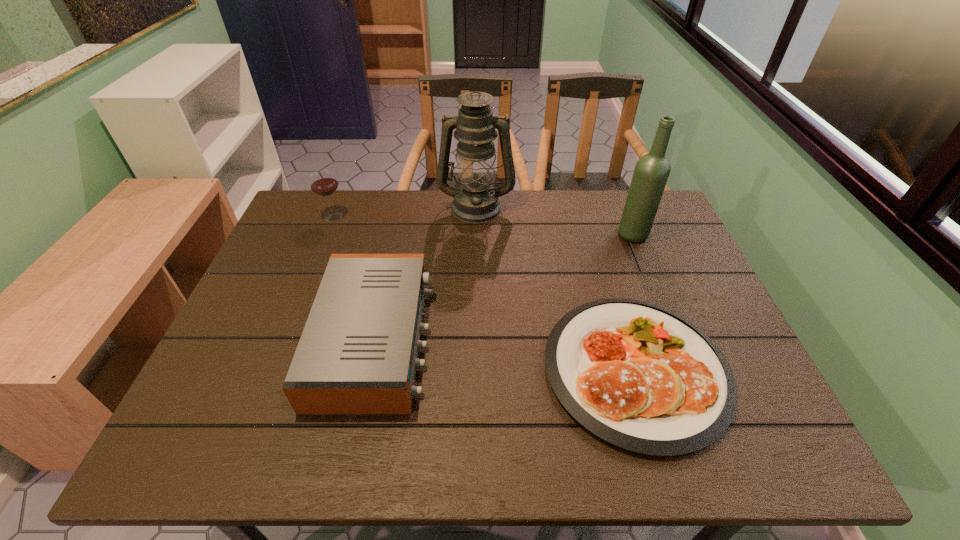
You are a GUI agent. You are given a task and a screenshot of the screen. Output one action in this format:
    pyautogui.click(x=<x>, y=<y>)
    Task: Click on the vacant space in between the wine bottle and the third tallest object
    Image resolution: width=960 pixels, height=540 pixels.
    Given the screenshot: What is the action you would take?
    pyautogui.click(x=483, y=225)

I want to click on blank region between the dish and the leftmost object, so click(x=485, y=293).

Identify which object is the fourth closest to the oil lamp. Please provide its 2D coordinates. Your answer should be formatted as a tuple, i.e. [(x, y)], where the tuple contains the x and y coordinates of a point satisfying the conditions above.

[(637, 375)]

The width and height of the screenshot is (960, 540). I want to click on object that ranks as the third closest to the leftmost object, so click(x=637, y=375).

The width and height of the screenshot is (960, 540). Identify the location of vacant space that satisfies the following two spatial constraints: 1. on the front side of the oil lamp; 2. on the control panel of the fourth tallest object. (475, 339).